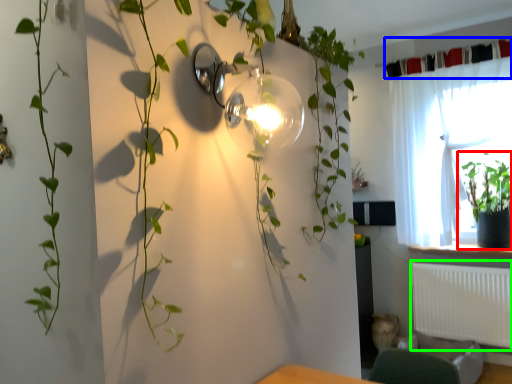
Question: Which is farther away from houseplant (highlighted by a red box)? curtain (highlighted by a blue box) or radiator (highlighted by a green box)?

Choices:
 (A) curtain
 (B) radiator

Answer: (A)